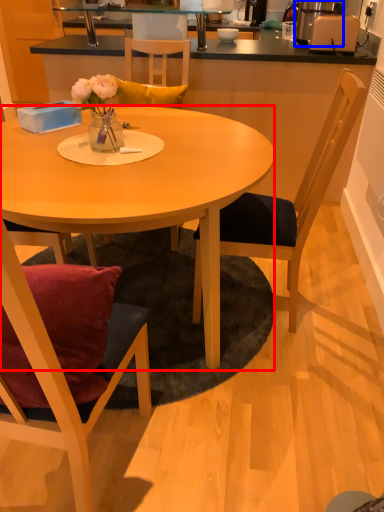
Question: Among these objects, which one is farthest to the camera, desk (highlighted by a red box) or appliance (highlighted by a blue box)?

Choices:
 (A) desk
 (B) appliance

Answer: (B)